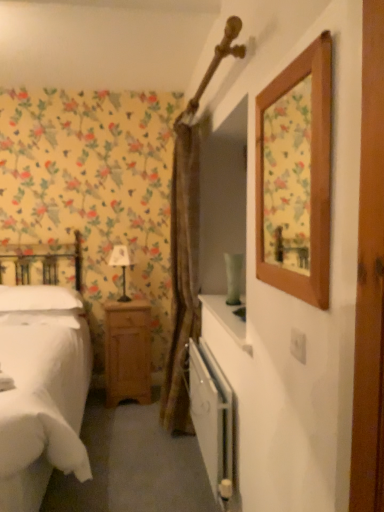
Question: Considering the relative positions of light brown wood nightstand at lower left and white fabric-covered table lamp at center-left in the image provided, is light brown wood nightstand at lower left to the left or to the right of white fabric-covered table lamp at center-left?

Choices:
 (A) right
 (B) left

Answer: (A)

Question: Looking at the image, does light brown wood nightstand at lower left seem bigger or smaller compared to white fabric-covered table lamp at center-left?

Choices:
 (A) small
 (B) big

Answer: (B)

Question: Estimate the real-world distances between objects in this image. Which object is farther from the white matte bed at left?

Choices:
 (A) wooden picture frame at upper right
 (B) brown textured curtain at center
 (C) white fabric-covered table lamp at center-left
 (D) white soft pillow at left
 (E) white metallic radiator at lower center

Answer: (A)

Question: Which is farther from the wooden picture frame at upper right?

Choices:
 (A) white soft pillow at left
 (B) brown textured curtain at center
 (C) white matte bed at left
 (D) white fabric-covered table lamp at center-left
 (E) light brown wood nightstand at lower left

Answer: (C)